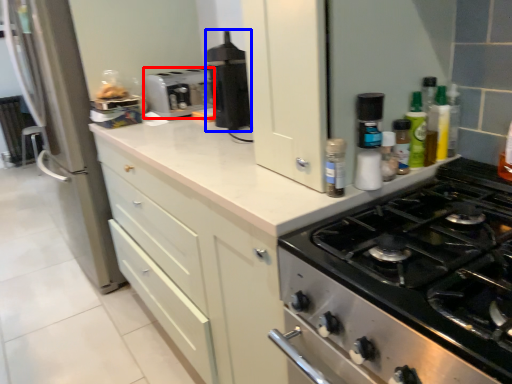
Question: Which object is further to the camera taking this photo, toaster (highlighted by a red box) or kitchen appliance (highlighted by a blue box)?

Choices:
 (A) toaster
 (B) kitchen appliance

Answer: (A)